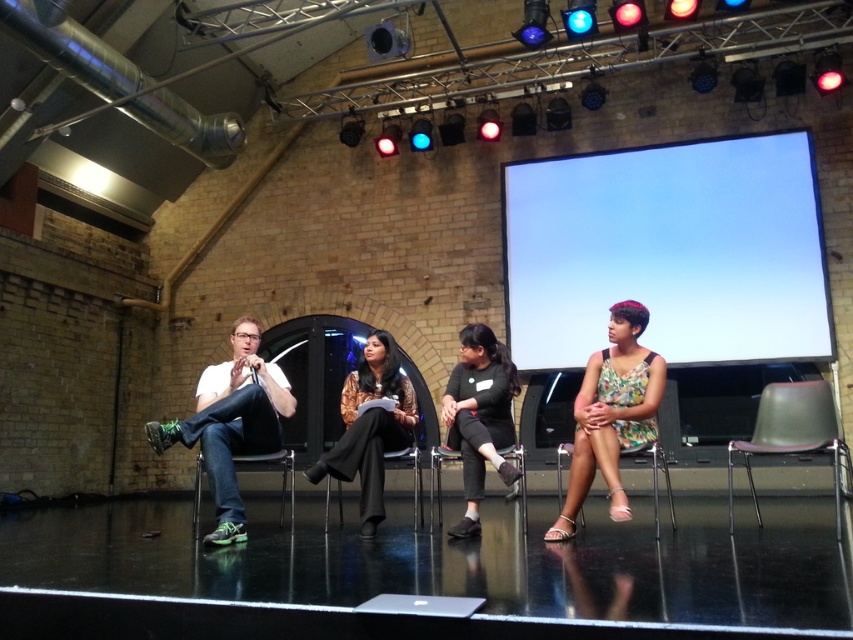
You are a stagehand responsible for setting up a camera to film the panel discussion. The camera must be placed exactly 6 meters away from the white matte projection screen at upper center to ensure proper focus. Based on the scene description, can the camera be positioned as required?

The white matte projection screen at upper center and camera are 5.56 meters apart from each other. Since 5.56 meters is less than 6 meters, the camera cannot be positioned exactly 6 meters away from the white matte projection screen at upper center as required.